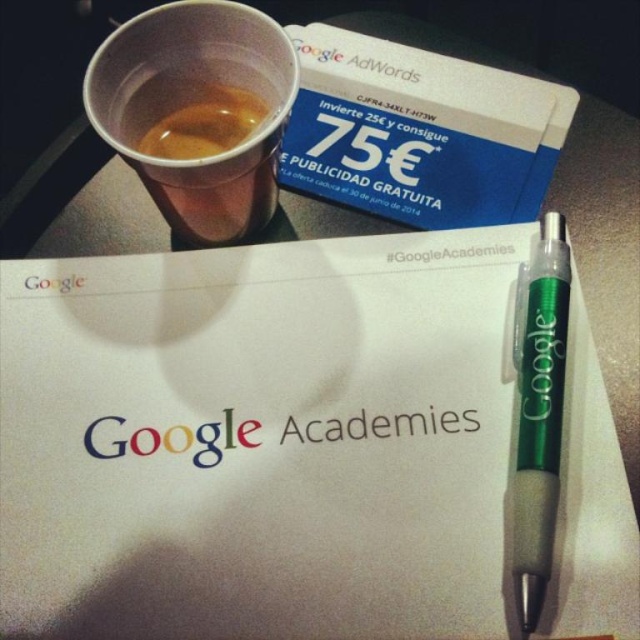
Question: Does white paper at center appear on the left side of translucent plastic cup at upper left?

Choices:
 (A) yes
 (B) no

Answer: (B)

Question: Which point appears closest to the camera in this image?

Choices:
 (A) (552, 532)
 (B) (145, 561)
 (C) (170, 170)

Answer: (A)

Question: Is white paper at center in front of green translucent pen at lower right?

Choices:
 (A) no
 (B) yes

Answer: (A)

Question: Which point is farther to the camera?

Choices:
 (A) green translucent pen at lower right
 (B) translucent plastic cup at upper left
 (C) white paper at center

Answer: (B)

Question: Is white paper at center closer to the viewer compared to translucent plastic cup at upper left?

Choices:
 (A) yes
 (B) no

Answer: (A)

Question: Which object is positioned closest to the green translucent pen at lower right?

Choices:
 (A) translucent plastic cup at upper left
 (B) white paper at center

Answer: (B)